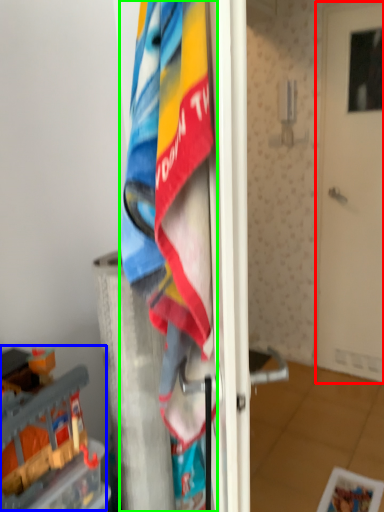
Question: Which object is the closest to the door (highlighted by a red box)? Choose among these: toy (highlighted by a blue box) or towel (highlighted by a green box).

Choices:
 (A) toy
 (B) towel

Answer: (A)